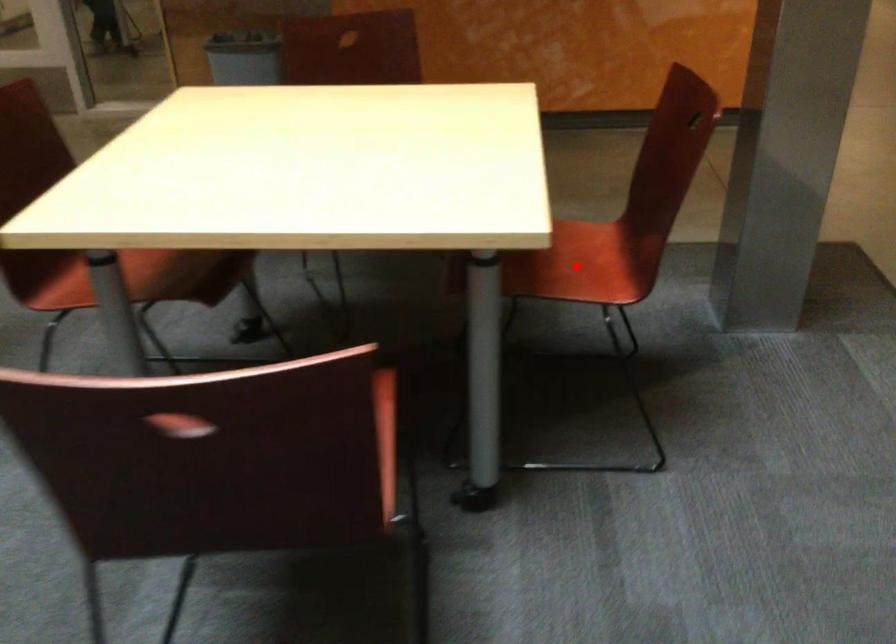
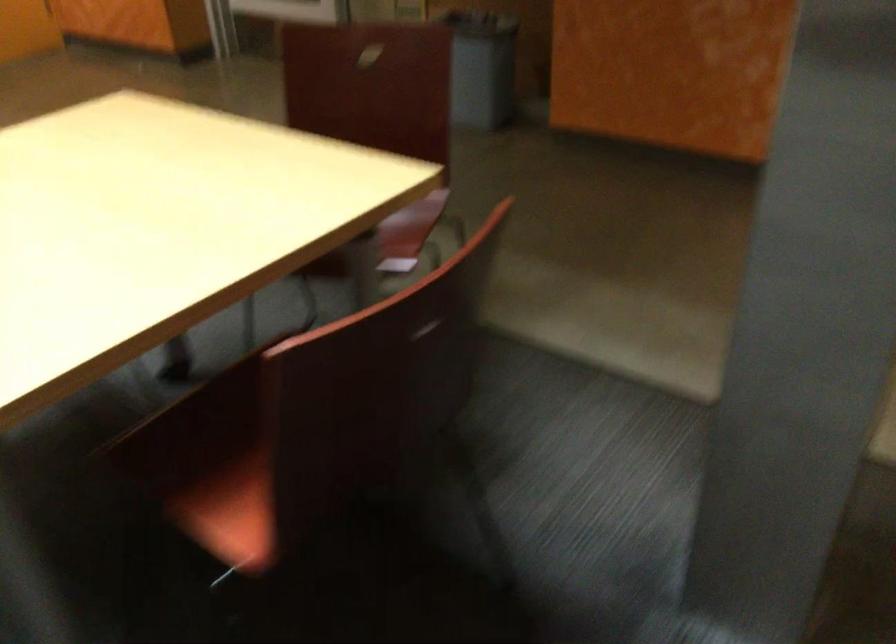
Question: I am providing you with two images of the same scene from different viewpoints. A red point is marked on the first image. Can you still see the location of the red point in image 2?

Choices:
 (A) Yes
 (B) No

Answer: (B)